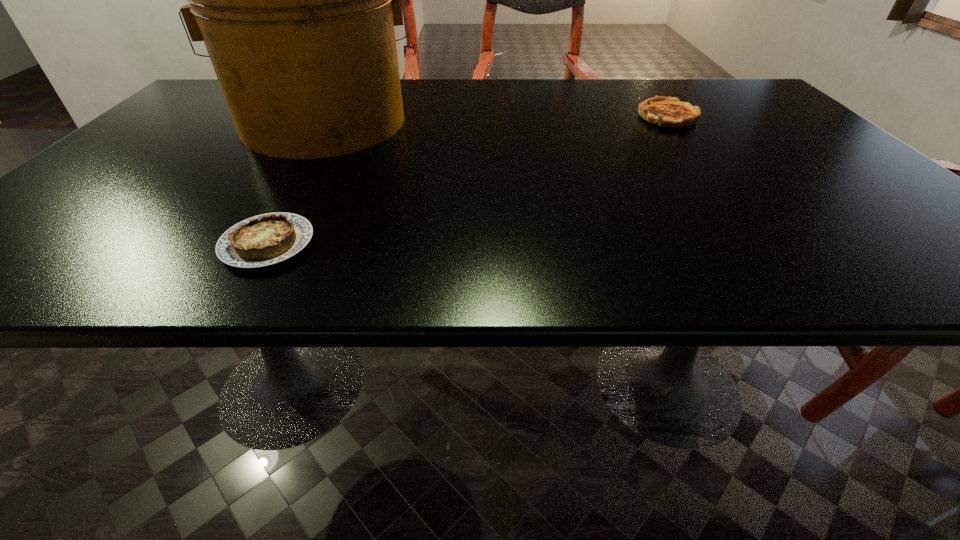
This screenshot has width=960, height=540. I want to click on object positioned at the near edge, so click(267, 239).

Locate an element on the screen. The width and height of the screenshot is (960, 540). object that is at the left edge is located at coordinates (296, 0).

In order to click on object positioned at the far left corner in this screenshot , I will do `click(296, 0)`.

Find the location of a particular element. This screenshot has height=540, width=960. free spot at the far edge of the desktop is located at coordinates (687, 97).

Locate an element on the screen. Image resolution: width=960 pixels, height=540 pixels. vacant space at the near edge of the desktop is located at coordinates (574, 253).

I want to click on vacant space at the left edge, so click(99, 174).

This screenshot has width=960, height=540. What are the coordinates of `free space at the right edge of the desktop` in the screenshot? It's located at (855, 187).

Find the location of a particular element. This screenshot has height=540, width=960. free space at the far right corner is located at coordinates (766, 112).

The image size is (960, 540). In order to click on blank region between the shorter quiche and the right quiche in this screenshot , I will do pos(468,180).

This screenshot has height=540, width=960. Find the location of `vacant area that lies between the shortest object and the rightmost object`. vacant area that lies between the shortest object and the rightmost object is located at coordinates (468, 180).